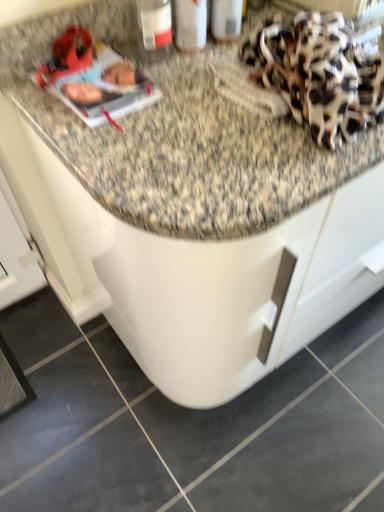
Where is `vacant area on top of matte plastic magazine at upper left (from a real-world perspective)`? vacant area on top of matte plastic magazine at upper left (from a real-world perspective) is located at coordinates 91,70.